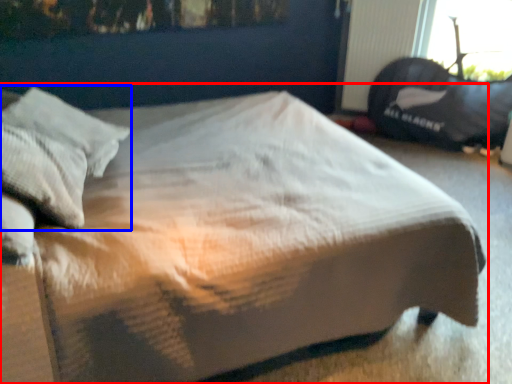
Question: Which point is further to the camera, bed (highlighted by a red box) or pillow (highlighted by a blue box)?

Choices:
 (A) bed
 (B) pillow

Answer: (B)